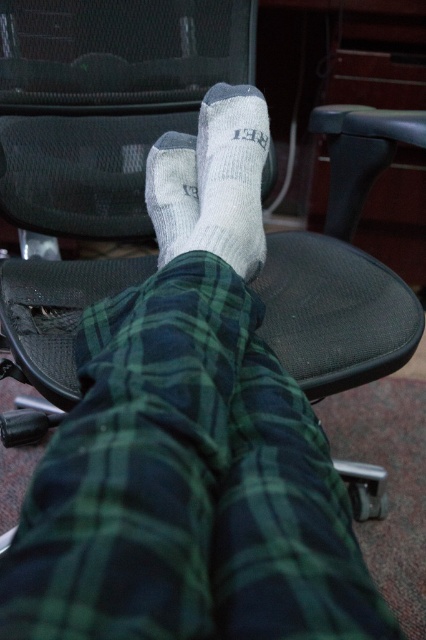
Question: Which of the following is the closest to the observer?

Choices:
 (A) gray/textured socks at center
 (B) green plaid pants at center

Answer: (B)

Question: Based on their relative distances, which object is nearer to the green plaid pants at center?

Choices:
 (A) gray/textured socks at center
 (B) gray/textured sock at center

Answer: (B)

Question: Does gray/textured sock at center appear on the right side of gray/textured socks at center?

Choices:
 (A) no
 (B) yes

Answer: (B)

Question: Which of the following is the farthest from the observer?

Choices:
 (A) (175, 193)
 (B) (154, 358)

Answer: (A)

Question: Does green plaid pants at center lie behind gray/textured socks at center?

Choices:
 (A) no
 (B) yes

Answer: (A)

Question: Observing the image, what is the correct spatial positioning of green plaid pants at center in reference to gray/textured sock at center?

Choices:
 (A) above
 (B) below

Answer: (B)